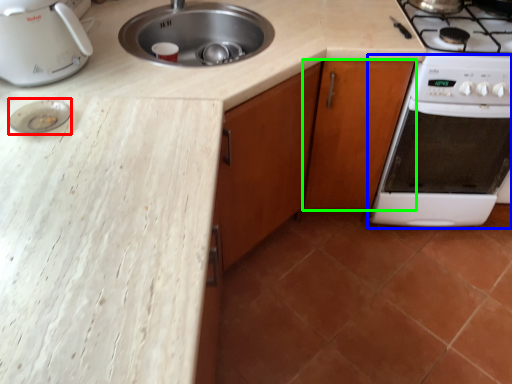
Question: Which object is positioned farthest from appliance (highlighted by a red box)? Select from oven (highlighted by a blue box) and cabinetry (highlighted by a green box).

Choices:
 (A) oven
 (B) cabinetry

Answer: (A)